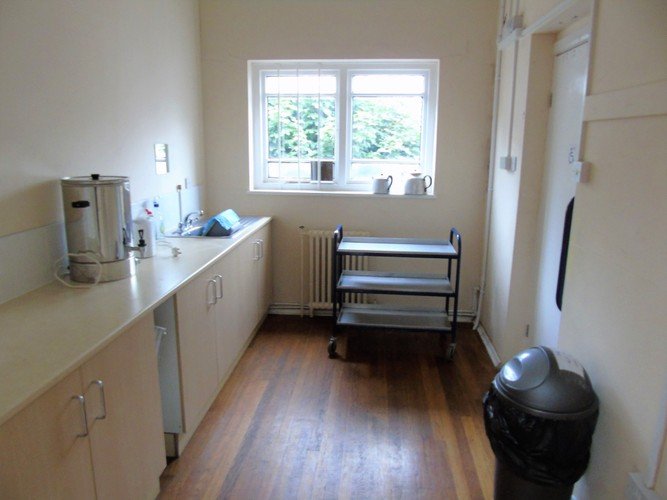
The height and width of the screenshot is (500, 667). I want to click on plank floor, so click(x=267, y=407), click(x=317, y=438), click(x=420, y=408), click(x=427, y=475), click(x=293, y=472), click(x=207, y=452).